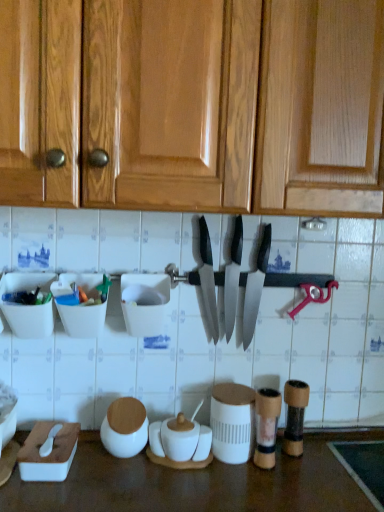
Question: Is translucent plastic container at left, the 1th tableware when ordered from left to right, a part of white matte jar at lower center, marked as the 2th tableware in a left-to-right arrangement?

Choices:
 (A) yes
 (B) no

Answer: (B)

Question: From the image's perspective, does white matte jar at lower center, positioned as the 5th tableware in right-to-left order, appear higher than translucent plastic container at left, the 1th tableware when ordered from left to right?

Choices:
 (A) yes
 (B) no

Answer: (B)

Question: Is white matte jar at lower center, positioned as the 5th tableware in right-to-left order, closer to the viewer compared to translucent plastic container at left, the 6th tableware viewed from the right?

Choices:
 (A) no
 (B) yes

Answer: (A)

Question: From a real-world perspective, is white matte jar at lower center, marked as the 2th tableware in a left-to-right arrangement, physically below translucent plastic container at left, the 1th tableware when ordered from left to right?

Choices:
 (A) no
 (B) yes

Answer: (B)

Question: Is the depth of white matte jar at lower center, marked as the 2th tableware in a left-to-right arrangement, greater than that of translucent plastic container at left, the 6th tableware viewed from the right?

Choices:
 (A) no
 (B) yes

Answer: (B)

Question: In the image, is matte black knife at center, arranged as the 1th kitchen knife when viewed from the right, on the left side or the right side of white matte jar at lower center, marked as the 2th tableware in a left-to-right arrangement?

Choices:
 (A) right
 (B) left

Answer: (A)

Question: Based on their sizes in the image, would you say matte black knife at center, arranged as the 1th kitchen knife when viewed from the right, is bigger or smaller than white matte jar at lower center, positioned as the 5th tableware in right-to-left order?

Choices:
 (A) small
 (B) big

Answer: (B)

Question: Considering the positions of matte black knife at center, arranged as the 1th kitchen knife when viewed from the right, and white matte jar at lower center, positioned as the 5th tableware in right-to-left order, in the image, is matte black knife at center, arranged as the 1th kitchen knife when viewed from the right, wider or thinner than white matte jar at lower center, positioned as the 5th tableware in right-to-left order,?

Choices:
 (A) wide
 (B) thin

Answer: (B)

Question: From the image's perspective, is matte black knife at center, arranged as the 1th kitchen knife when viewed from the right, above or below white matte jar at lower center, positioned as the 5th tableware in right-to-left order?

Choices:
 (A) above
 (B) below

Answer: (A)

Question: Would you say polished silver knife at center, marked as the 1th kitchen knife in a left-to-right arrangement, is to the left or to the right of polished silver knife at center, the second kitchen knife positioned from the right, in the picture?

Choices:
 (A) right
 (B) left

Answer: (B)

Question: In the image, is polished silver knife at center, marked as the 1th kitchen knife in a left-to-right arrangement, positioned in front of or behind polished silver knife at center, which is counted as the 2th kitchen knife, starting from the left?

Choices:
 (A) behind
 (B) front

Answer: (B)

Question: From the image's perspective, is polished silver knife at center, which is the 3th kitchen knife from right to left, positioned above or below polished silver knife at center, which is counted as the 2th kitchen knife, starting from the left?

Choices:
 (A) below
 (B) above

Answer: (B)

Question: In terms of height, does polished silver knife at center, which is the 3th kitchen knife from right to left, look taller or shorter compared to polished silver knife at center, which is counted as the 2th kitchen knife, starting from the left?

Choices:
 (A) tall
 (B) short

Answer: (B)

Question: In the image, is white matte jar at lower center, marked as the 2th tableware in a left-to-right arrangement, on the left side or the right side of wooden textured salt and pepper shakers at lower center, which appears as the 6th tableware when viewed from the left?

Choices:
 (A) right
 (B) left

Answer: (B)

Question: In terms of size, does white matte jar at lower center, marked as the 2th tableware in a left-to-right arrangement, appear bigger or smaller than wooden textured salt and pepper shakers at lower center, which appears as the 6th tableware when viewed from the left?

Choices:
 (A) big
 (B) small

Answer: (A)